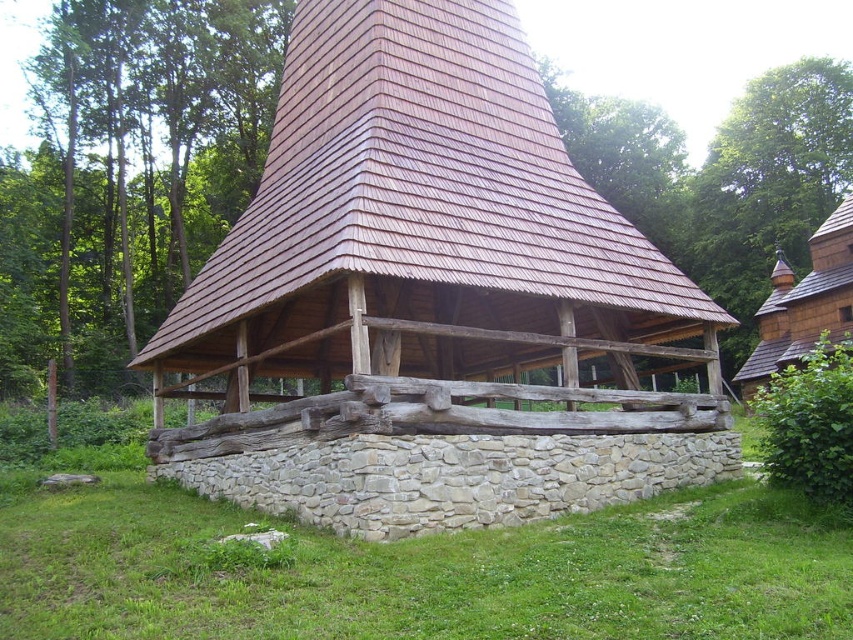
Question: Is green grass at lower center wider than brown wooden shingles at center?

Choices:
 (A) no
 (B) yes

Answer: (B)

Question: Which of these objects is positioned farthest from the brown wooden hut at upper right?

Choices:
 (A) green grass at lower center
 (B) brown wooden shingles at center

Answer: (A)

Question: Is green grass at lower center closer to camera compared to brown wooden shingles at center?

Choices:
 (A) yes
 (B) no

Answer: (A)

Question: Which point is farther from the camera taking this photo?

Choices:
 (A) (817, 314)
 (B) (463, 595)
 (C) (463, 20)

Answer: (A)

Question: Which point is farther from the camera taking this photo?

Choices:
 (A) (503, 269)
 (B) (44, 557)
 (C) (782, 304)

Answer: (C)

Question: Is green grass at lower center below brown wooden hut at upper right?

Choices:
 (A) no
 (B) yes

Answer: (B)